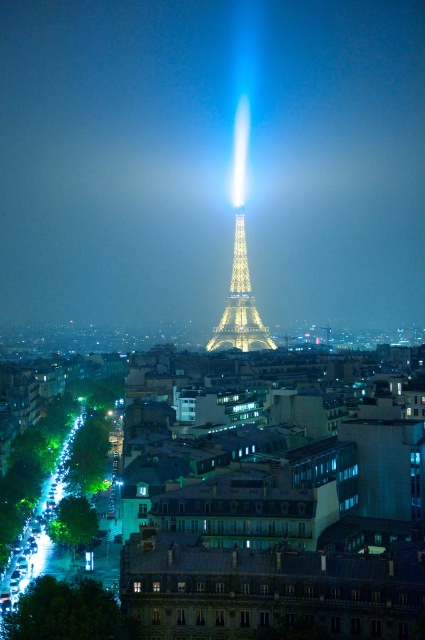
You are standing in front of the Eiffel Tower and want to take a photo of the matte glass buildings at center. Where should you position yourself to capture them in the frame?

The matte glass buildings at center are located at point [274,492], so you should position yourself directly in front of them to capture them in the frame.

You are a photographer standing in front of the matte glass buildings at center and the illuminated steel eiffel tower at center. You want to take a photo that includes both objects. Which object should you focus on first to ensure both are in sharp focus?

You should focus on the matte glass buildings at center first because it is closer to you than the illuminated steel eiffel tower at center. By focusing on the closer object, the depth of field may extend to include the farther object in acceptable focus.